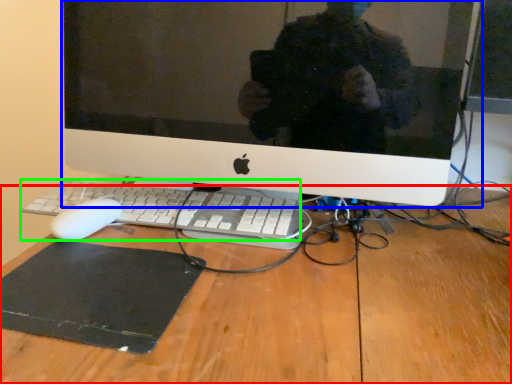
Question: Which object is positioned farthest from desk (highlighted by a red box)? Select from computer monitor (highlighted by a blue box) and computer keyboard (highlighted by a green box).

Choices:
 (A) computer monitor
 (B) computer keyboard

Answer: (A)